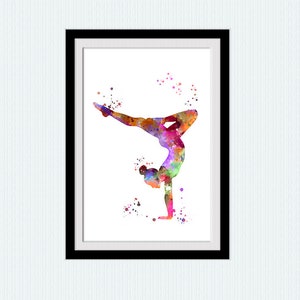
The width and height of the screenshot is (300, 300). Identify the location of white canvas. (112, 218).